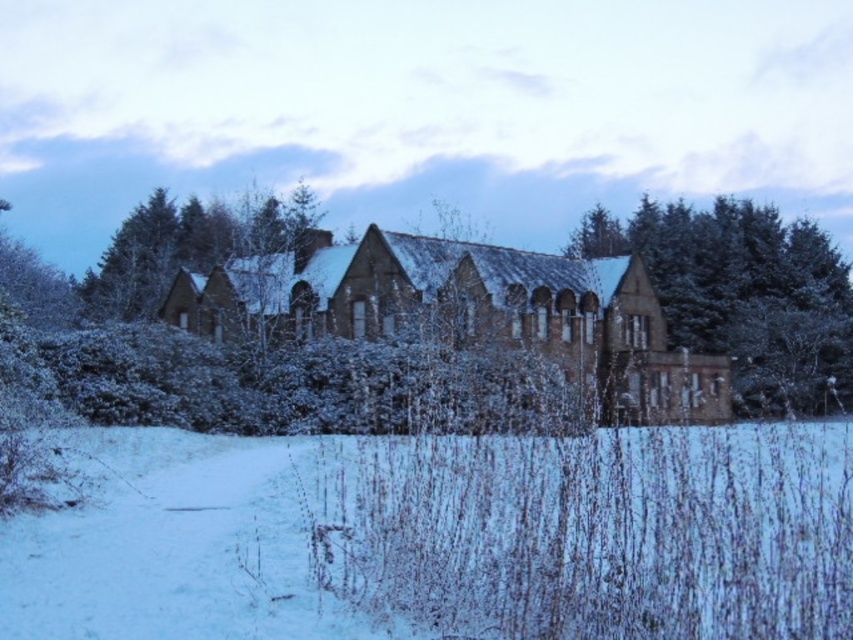
Question: In this image, where is white fluffy snow at lower center located relative to brown stone church at center?

Choices:
 (A) right
 (B) left

Answer: (B)

Question: Which object is the farthest from the brown stone church at center?

Choices:
 (A) green textured tree at center
 (B) white fluffy snow at lower center

Answer: (A)

Question: Which object is the closest to the green textured tree at center?

Choices:
 (A) brown stone church at center
 (B) white fluffy snow at lower center

Answer: (A)

Question: Considering the relative positions of white fluffy snow at lower center and brown stone church at center in the image provided, where is white fluffy snow at lower center located with respect to brown stone church at center?

Choices:
 (A) below
 (B) above

Answer: (A)

Question: Among these objects, which one is nearest to the camera?

Choices:
 (A) brown stone church at center
 (B) green textured tree at center

Answer: (A)

Question: Can you confirm if brown stone church at center is smaller than green textured tree at center?

Choices:
 (A) yes
 (B) no

Answer: (A)